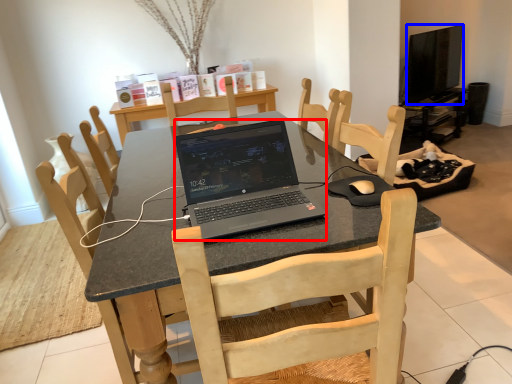
Question: Which object is closer to the camera taking this photo, laptop (highlighted by a red box) or television (highlighted by a blue box)?

Choices:
 (A) laptop
 (B) television

Answer: (A)